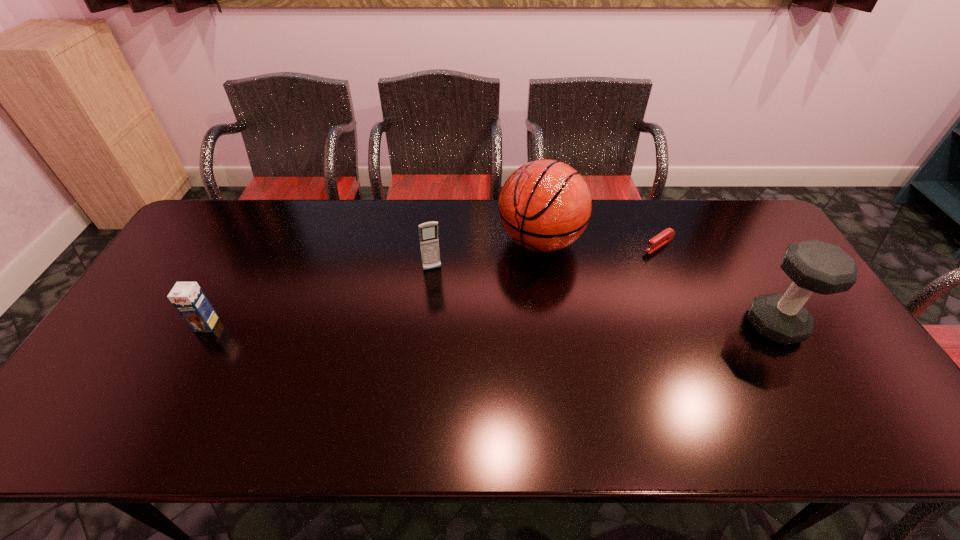
Locate an element on the screen. The image size is (960, 540). free space on the desktop that is between the chocolate milk and the rightmost object and is positioned on the side with spill of the third object from left to right is located at coordinates (438, 325).

The image size is (960, 540). In order to click on vacant space on the desktop that is between the chocolate milk and the dumbbell and is positioned on the front-facing side of the stapler in this screenshot , I will do `click(539, 325)`.

Locate an element on the screen. The height and width of the screenshot is (540, 960). vacant space on the desktop that is between the leftmost object and the rightmost object and is positioned on the front-facing side of the third tallest object is located at coordinates (450, 325).